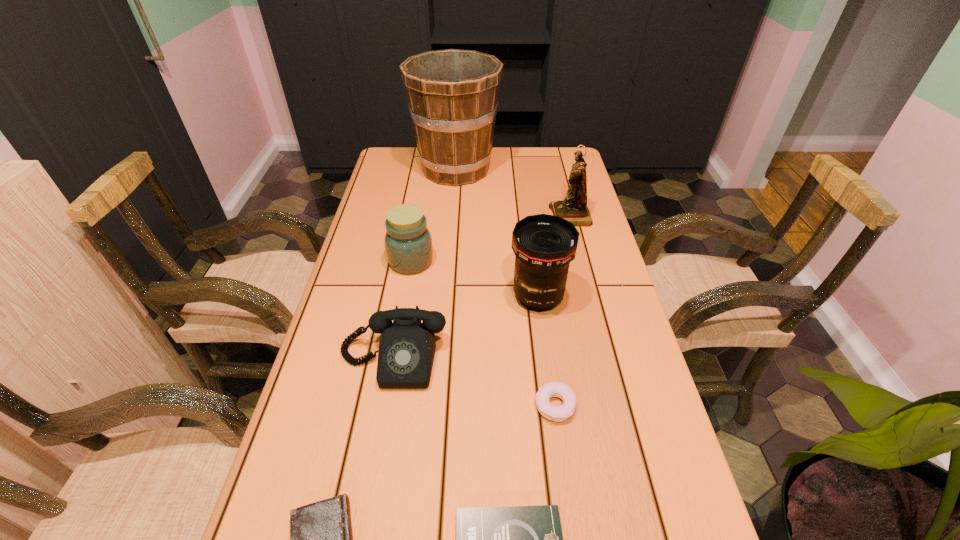
Identify the location of the farthest object. The height and width of the screenshot is (540, 960). (452, 94).

The height and width of the screenshot is (540, 960). In order to click on the tallest object in this screenshot , I will do `click(452, 94)`.

At what (x,y) coordinates should I click in order to perform the action: click on the seventh nearest object. Please return your answer as a coordinate pair (x, y). The image size is (960, 540). Looking at the image, I should click on (573, 208).

At what (x,y) coordinates should I click in order to perform the action: click on telephoto lens. Please return your answer as a coordinate pair (x, y). The image size is (960, 540). Looking at the image, I should click on (544, 245).

Where is `the fifth shortest object`? The image size is (960, 540). the fifth shortest object is located at coordinates (408, 243).

This screenshot has width=960, height=540. I want to click on jar, so click(408, 243).

The image size is (960, 540). I want to click on telephone, so click(407, 347).

Image resolution: width=960 pixels, height=540 pixels. What are the coordinates of `doughnut` in the screenshot? It's located at (551, 389).

At what (x,y) coordinates should I click in order to perform the action: click on free spot located 0.070m on the right of the bucket. Please return your answer as a coordinate pair (x, y). The height and width of the screenshot is (540, 960). Looking at the image, I should click on (518, 169).

Locate an element on the screen. free space located on the front-facing side of the figurine is located at coordinates (480, 216).